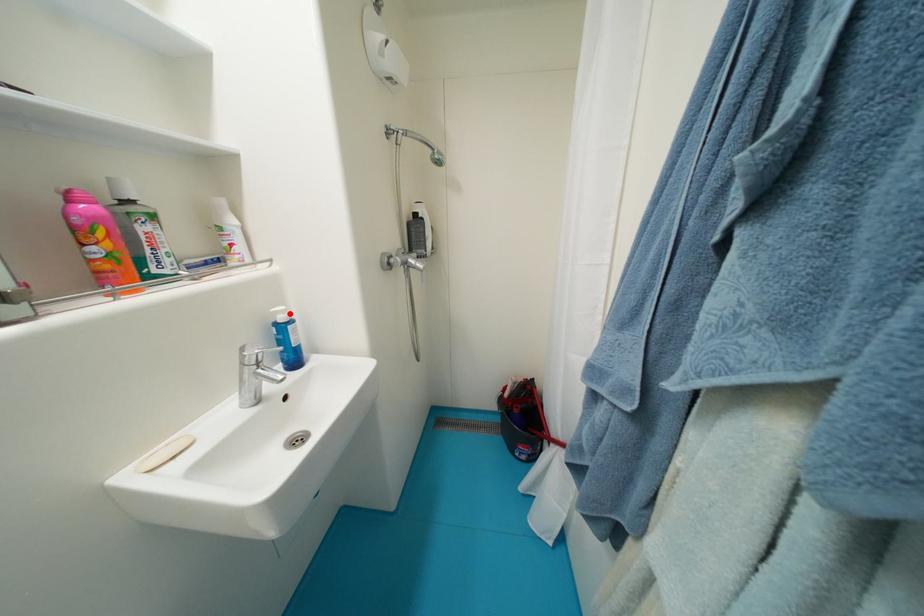
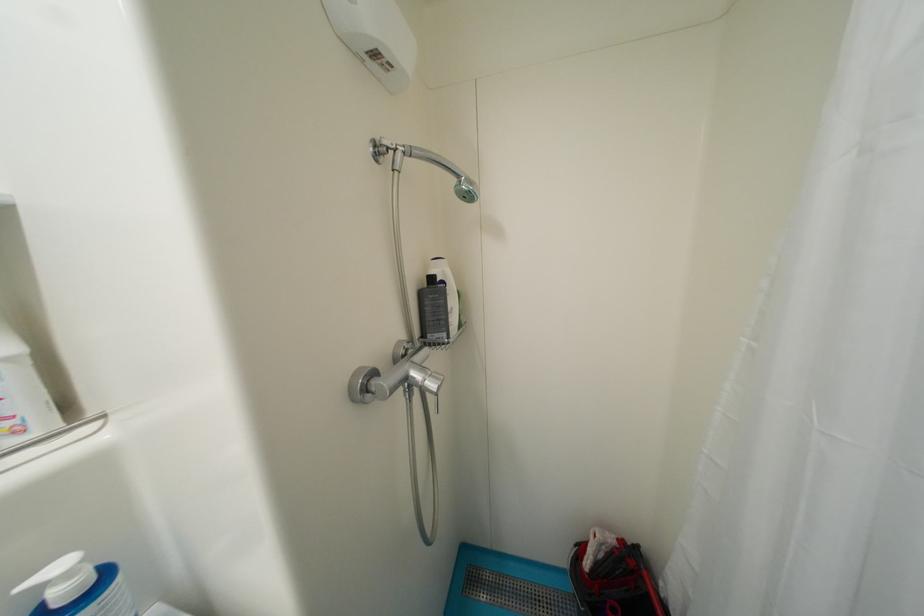
Where in the second image is the point corresponding to the highlighted location from the first image?

(75, 576)